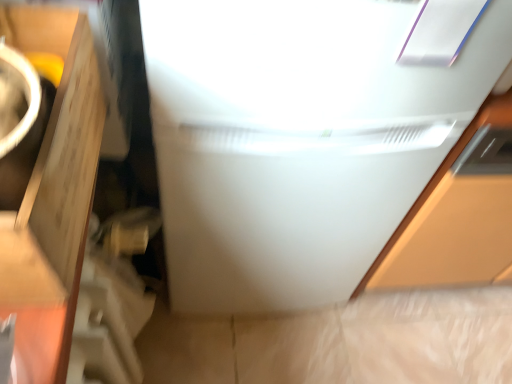
What do you see at coordinates (53, 204) in the screenshot? I see `matte brown cardboard at left` at bounding box center [53, 204].

Identify the location of matte brown cardboard at left. [53, 204].

What do you see at coordinates (297, 140) in the screenshot? This screenshot has height=384, width=512. I see `white glossy refrigerator at center` at bounding box center [297, 140].

The width and height of the screenshot is (512, 384). Identify the location of white glossy refrigerator at center. (297, 140).

Identify the location of matte brown cardboard at left. The width and height of the screenshot is (512, 384). (53, 204).

From the picture: Is white glossy refrigerator at center to the left of matte brown cardboard at left from the viewer's perspective?

No.

Considering the positions of objects white glossy refrigerator at center and matte brown cardboard at left in the image provided, who is in front, white glossy refrigerator at center or matte brown cardboard at left?

matte brown cardboard at left is in front.

Between point (288, 143) and point (38, 216), which one is positioned behind?

The point (288, 143) is behind.

From the image's perspective, relative to matte brown cardboard at left, is white glossy refrigerator at center above or below?

Based on their image positions, white glossy refrigerator at center is located above matte brown cardboard at left.

From a real-world perspective, which is physically above, white glossy refrigerator at center or matte brown cardboard at left?

From a 3D spatial view, matte brown cardboard at left is above.

From the picture: Which of these two, white glossy refrigerator at center or matte brown cardboard at left, is wider?

white glossy refrigerator at center.

Is white glossy refrigerator at center taller or shorter than matte brown cardboard at left?

In the image, white glossy refrigerator at center appears to be taller than matte brown cardboard at left.

Who is bigger, white glossy refrigerator at center or matte brown cardboard at left?

white glossy refrigerator at center is bigger.

Is matte brown cardboard at left surrounded by white glossy refrigerator at center?

No, matte brown cardboard at left is located outside of white glossy refrigerator at center.

Is white glossy refrigerator at center with matte brown cardboard at left?

white glossy refrigerator at center is not next to matte brown cardboard at left, and they're not touching.

Is white glossy refrigerator at center oriented towards matte brown cardboard at left?

No, white glossy refrigerator at center does not turn towards matte brown cardboard at left.

How much distance is there between white glossy refrigerator at center and matte brown cardboard at left?

white glossy refrigerator at center is 39.14 centimeters away from matte brown cardboard at left.

Where is `refrigerator that is on the right side of matte brown cardboard at left`? refrigerator that is on the right side of matte brown cardboard at left is located at coordinates (x=297, y=140).

Looking at this image, considering the relative positions of matte brown cardboard at left and white glossy refrigerator at center in the image provided, is matte brown cardboard at left to the left of white glossy refrigerator at center from the viewer's perspective?

Indeed, matte brown cardboard at left is positioned on the left side of white glossy refrigerator at center.

In the image, is matte brown cardboard at left positioned in front of or behind white glossy refrigerator at center?

matte brown cardboard at left is in front of white glossy refrigerator at center.

Considering the positions of point (86, 77) and point (377, 131), is point (86, 77) closer or farther from the camera than point (377, 131)?

Point (86, 77) appears to be closer to the viewer than point (377, 131).

From the image's perspective, which object appears higher, matte brown cardboard at left or white glossy refrigerator at center?

white glossy refrigerator at center.

From a real-world perspective, which object rests below the other?

From a 3D spatial view, white glossy refrigerator at center is below.

Is matte brown cardboard at left wider than white glossy refrigerator at center?

In fact, matte brown cardboard at left might be narrower than white glossy refrigerator at center.

Is matte brown cardboard at left shorter than white glossy refrigerator at center?

Yes, matte brown cardboard at left is shorter than white glossy refrigerator at center.

In terms of size, does matte brown cardboard at left appear bigger or smaller than white glossy refrigerator at center?

Clearly, matte brown cardboard at left is smaller in size than white glossy refrigerator at center.

Is white glossy refrigerator at center inside matte brown cardboard at left?

Actually, white glossy refrigerator at center is outside matte brown cardboard at left.

Based on the photo, is matte brown cardboard at left directly adjacent to white glossy refrigerator at center?

No, matte brown cardboard at left is not touching white glossy refrigerator at center.

Is matte brown cardboard at left oriented towards white glossy refrigerator at center?

No, matte brown cardboard at left does not turn towards white glossy refrigerator at center.

From the picture: How distant is matte brown cardboard at left from white glossy refrigerator at center?

matte brown cardboard at left is 15.41 inches away from white glossy refrigerator at center.

The width and height of the screenshot is (512, 384). Find the location of `refrigerator behind the matte brown cardboard at left`. refrigerator behind the matte brown cardboard at left is located at coordinates (297, 140).

Locate an element on the screen. The height and width of the screenshot is (384, 512). cardboard box that is in front of the white glossy refrigerator at center is located at coordinates (53, 204).

Image resolution: width=512 pixels, height=384 pixels. I want to click on cardboard box positioned vertically above the white glossy refrigerator at center (from a real-world perspective), so tap(53, 204).